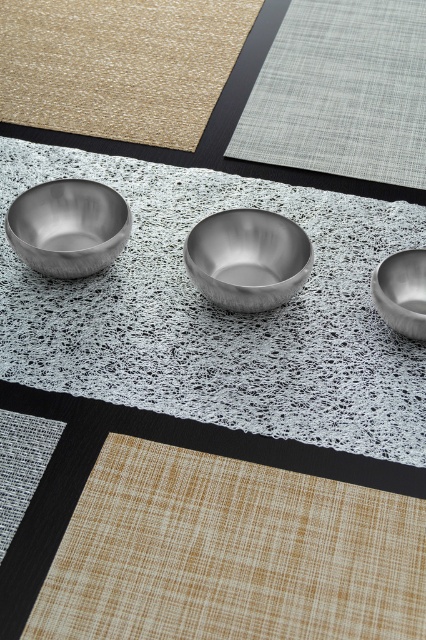
You are arranging a dinner party and want to place a decorative centerpiece on the table. Considering the beige woven mat at upper left and the brushed metal bowl at center, which surface can accommodate a larger centerpiece?

The beige woven mat at upper left has a larger size compared to the brushed metal bowl at center, so it can accommodate a larger centerpiece.

You are looking at the table setting and want to place a small decorative item between the two points marked as point (353, 93) and point (25, 253). Which point should you move closer to ensure the item is placed in front of both points?

You should move closer to point (353, 93) because it is further to the viewer than point (25, 253). Placing the item near this point will ensure it is in front of both.